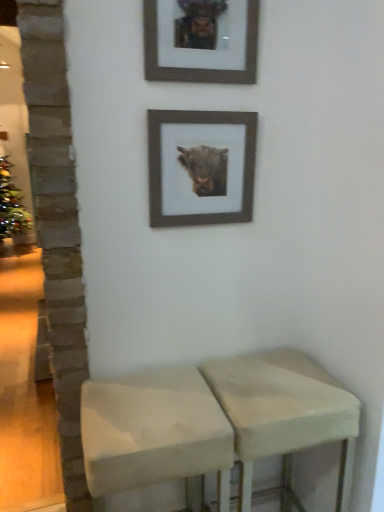
Question: Is wooden frame at upper center, positioned as the second picture frame in top-to-bottom order, at the right side of white fabric stool at center, which ranks as the 1th stool in left-to-right order?

Choices:
 (A) no
 (B) yes

Answer: (B)

Question: From the image's perspective, does wooden frame at upper center, positioned as the second picture frame in top-to-bottom order, appear lower than white fabric stool at center, which ranks as the 1th stool in left-to-right order?

Choices:
 (A) yes
 (B) no

Answer: (B)

Question: Is wooden frame at upper center, positioned as the second picture frame in top-to-bottom order, far away from white fabric stool at center, positioned as the second stool in right-to-left order?

Choices:
 (A) no
 (B) yes

Answer: (A)

Question: Does wooden frame at upper center, positioned as the second picture frame in top-to-bottom order, have a lesser height compared to white fabric stool at center, positioned as the second stool in right-to-left order?

Choices:
 (A) no
 (B) yes

Answer: (B)

Question: Is wooden frame at upper center, placed as the 1th picture frame when sorted from bottom to top, surrounding white fabric stool at center, which ranks as the 1th stool in left-to-right order?

Choices:
 (A) yes
 (B) no

Answer: (B)

Question: Based on their sizes in the image, would you say beige fabric stool at lower center, the second stool from the left, is bigger or smaller than white fabric stool at center, which ranks as the 1th stool in left-to-right order?

Choices:
 (A) small
 (B) big

Answer: (B)

Question: From their relative heights in the image, would you say beige fabric stool at lower center, the second stool from the left, is taller or shorter than white fabric stool at center, which ranks as the 1th stool in left-to-right order?

Choices:
 (A) short
 (B) tall

Answer: (B)

Question: From a real-world perspective, is beige fabric stool at lower center, the second stool from the left, above or below white fabric stool at center, which ranks as the 1th stool in left-to-right order?

Choices:
 (A) above
 (B) below

Answer: (B)

Question: Do you think beige fabric stool at lower center, the second stool from the left, is within white fabric stool at center, which ranks as the 1th stool in left-to-right order, or outside of it?

Choices:
 (A) outside
 (B) inside

Answer: (A)

Question: In terms of width, does wooden frame at upper center, positioned as the second picture frame in top-to-bottom order, look wider or thinner when compared to white fabric stool at center, positioned as the second stool in right-to-left order?

Choices:
 (A) thin
 (B) wide

Answer: (A)

Question: From the image's perspective, is wooden frame at upper center, positioned as the second picture frame in top-to-bottom order, above or below white fabric stool at center, which ranks as the 1th stool in left-to-right order?

Choices:
 (A) above
 (B) below

Answer: (A)

Question: Considering their positions, is wooden frame at upper center, placed as the 1th picture frame when sorted from bottom to top, located in front of or behind white fabric stool at center, which ranks as the 1th stool in left-to-right order?

Choices:
 (A) front
 (B) behind

Answer: (B)

Question: Is point (238, 165) closer or farther from the camera than point (132, 478)?

Choices:
 (A) closer
 (B) farther

Answer: (B)

Question: In the image, is beige fabric stool at lower center, the second stool from the left, on the left side or the right side of wooden picture frame at upper center, positioned as the second picture frame in bottom-to-top order?

Choices:
 (A) right
 (B) left

Answer: (A)

Question: Relative to wooden picture frame at upper center, positioned as the second picture frame in bottom-to-top order, is beige fabric stool at lower center, the second stool from the left, in front or behind?

Choices:
 (A) front
 (B) behind

Answer: (A)